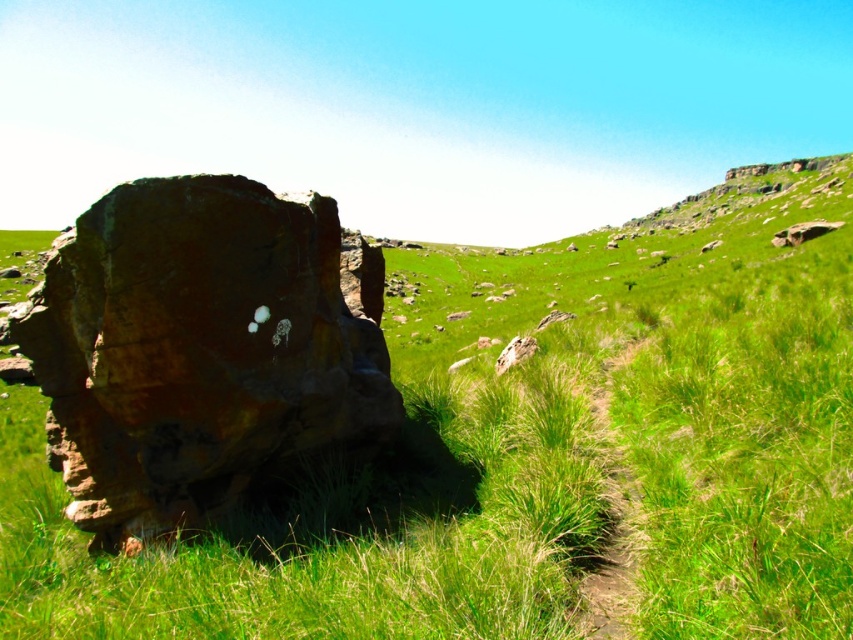
Question: Among these points, which one is nearest to the camera?

Choices:
 (A) (810, 236)
 (B) (234, 273)
 (C) (744, 208)

Answer: (B)

Question: Considering the real-world distances, which object is closest to the smooth brown rock at upper right?

Choices:
 (A) brown dirt path at center
 (B) green grassy at left
 (C) brown rough rock at left

Answer: (B)

Question: Which point is closer to the camera taking this photo?

Choices:
 (A) (670, 310)
 (B) (606, 566)

Answer: (B)

Question: Is green grassy at left to the right of green grassy hillside at upper center from the viewer's perspective?

Choices:
 (A) no
 (B) yes

Answer: (A)

Question: Can you confirm if green grassy hillside at upper center is positioned to the left of smooth brown rock at upper right?

Choices:
 (A) yes
 (B) no

Answer: (B)

Question: Can you confirm if brown rough rock at left is positioned below brown dirt path at center?

Choices:
 (A) yes
 (B) no

Answer: (B)